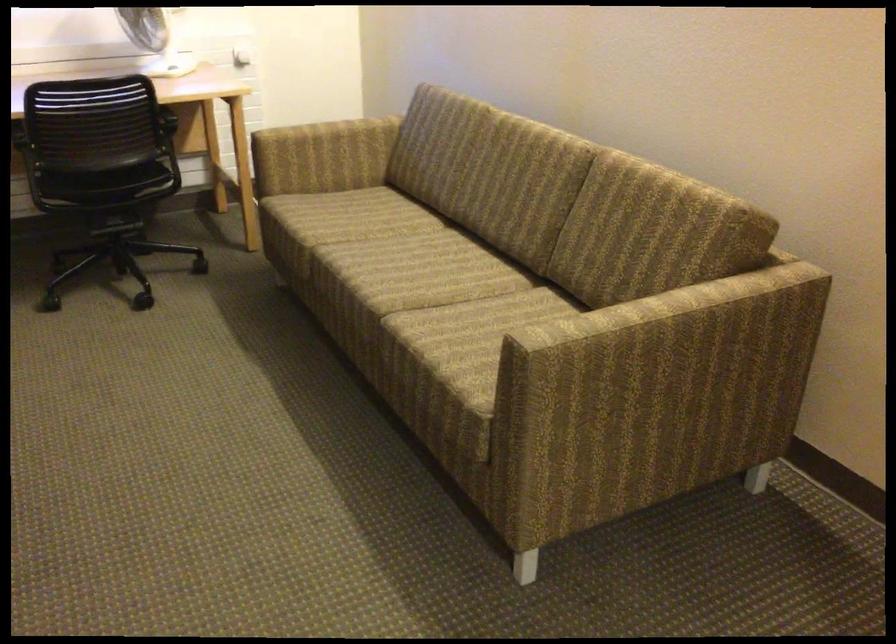
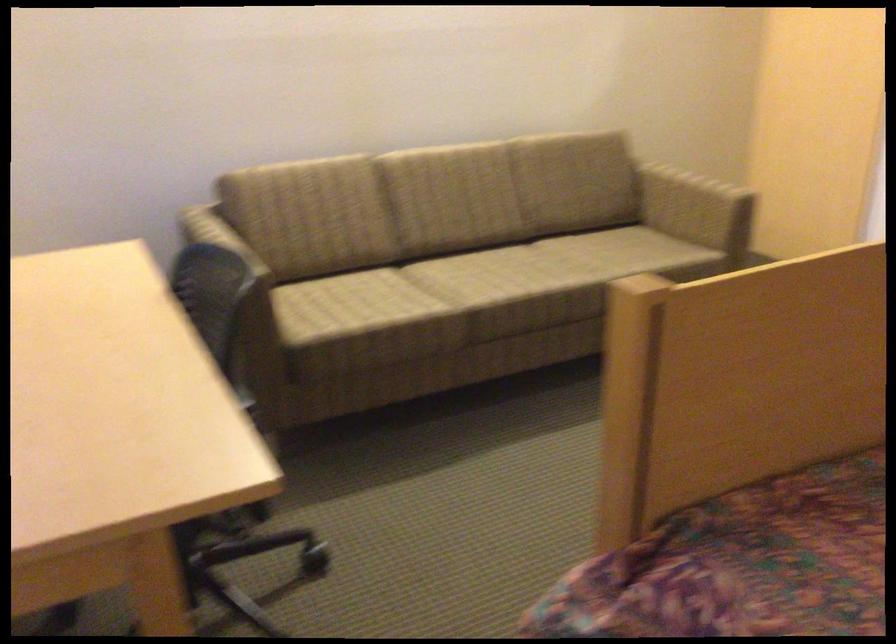
Locate, in the second image, the point that corresponds to pixel 400 252 in the first image.

(470, 279)